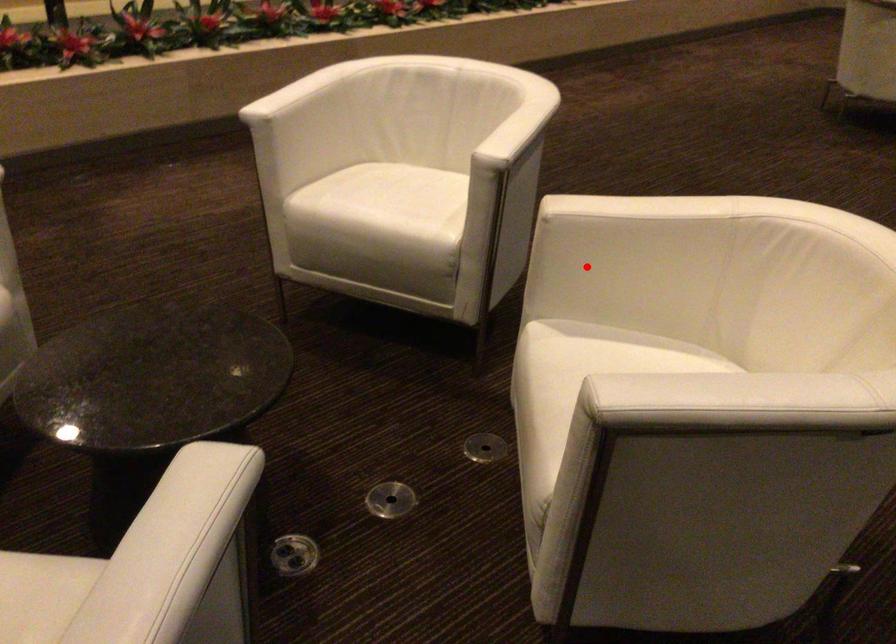
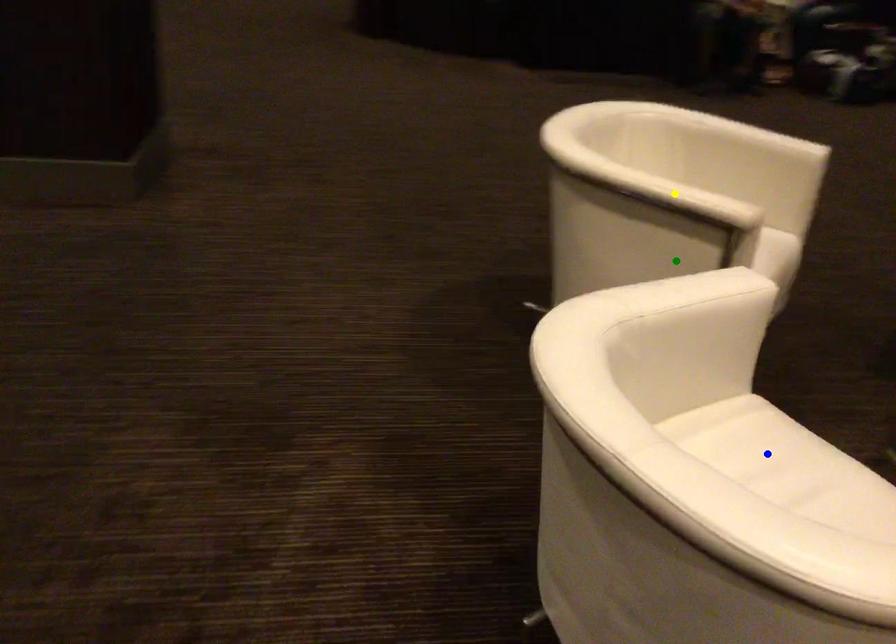
Question: I am providing you with two images of the same scene from different viewpoints. A red point is marked on the first image. You are given multiple points on the second image. Which spot in image 2 lines up with the point in image 1?

Choices:
 (A) yellow point
 (B) blue point
 (C) green point

Answer: (C)